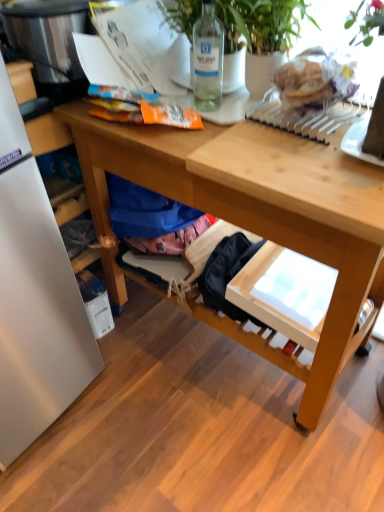
Image resolution: width=384 pixels, height=512 pixels. I want to click on free space above wooden desk at center (from a real-world perspective), so [262, 129].